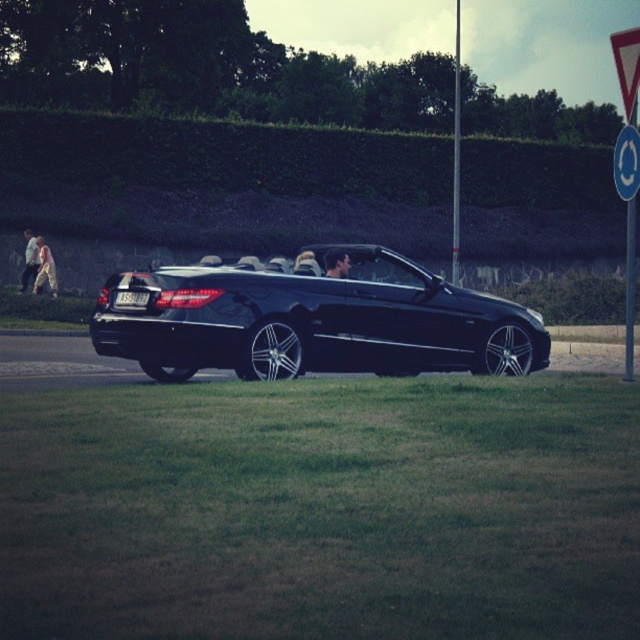
You are a pedestrian standing near the black convertible car parked on the side of the road. You notice two items in the scene. One is the blue circular sign at upper right and the other is the light beige fabric dress at left. Which of these two items is nearer to you?

The blue circular sign at upper right is closer to the viewer than the light beige fabric dress at left.

You are driving a car and want to park in the parking lot near the blue circular sign at upper right. The parking space is 12 meters long. Can you park your car there?

The distance between the blue circular sign at upper right and the camera is 12.67 meters, but the parking space is only 12 meters long. Therefore, the parking space is shorter than the distance between the blue circular sign at upper right and the camera, so it might not be sufficient for your car. Please check the parking space length again.

You are a fashion designer observing a photoshoot setup. You notice the light beige fabric dress at left and the light beige fabric pants at left. Which clothing item has a greater width?

The light beige fabric dress at left has a greater width than the light beige fabric pants at left.